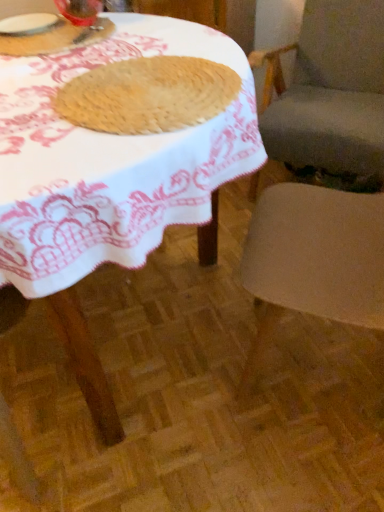
Locate an element on the screen. Image resolution: width=384 pixels, height=512 pixels. vacant region in front of white glossy plate at upper left, which is the first tableware in left-to-right order is located at coordinates (35, 46).